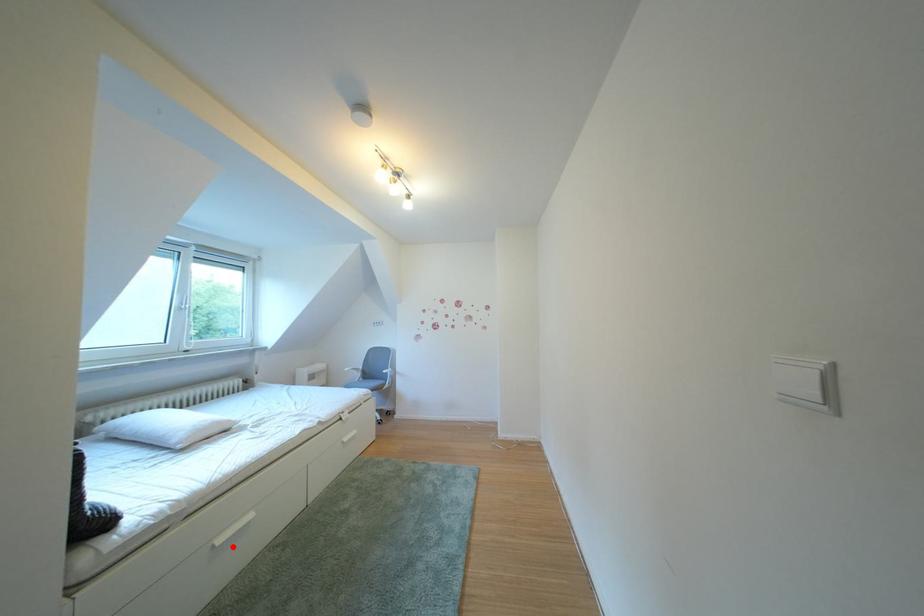
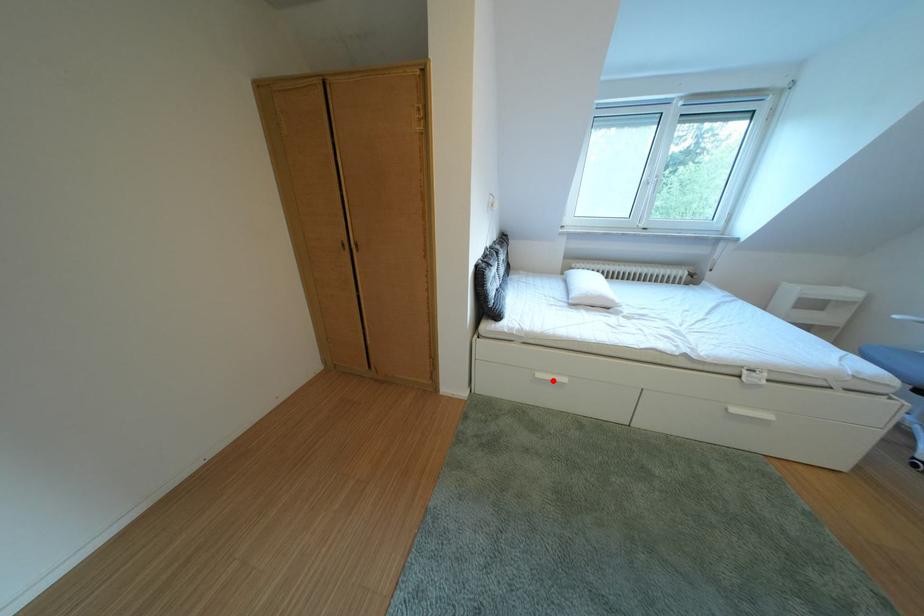
I am providing you with two images of the same scene from different viewpoints. A red point is marked on the first image and another point is marked on the second image. Is the red point in image1 aligned with the point shown in image2?

Yes